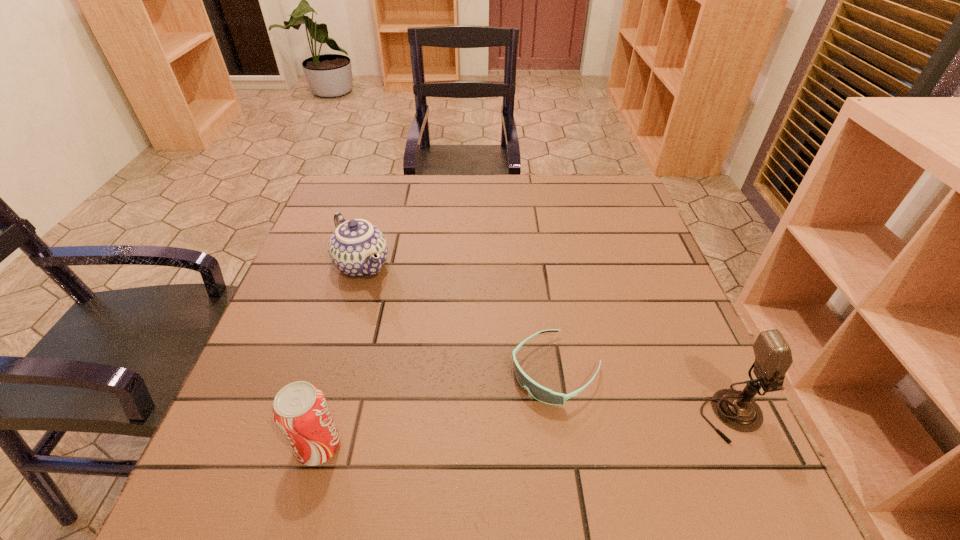
The width and height of the screenshot is (960, 540). Find the location of `free space between the soda can and the shortest object`. free space between the soda can and the shortest object is located at coordinates (438, 408).

In order to click on vacant area that lies between the farthest object and the tallest object in this screenshot , I will do `click(547, 340)`.

Identify the location of free space between the microphone and the soda can. This screenshot has width=960, height=540. (525, 431).

Identify the location of vacant space that's between the soda can and the rightmost object. (525, 431).

Locate an element on the screen. unoccupied position between the second object from right to left and the farthest object is located at coordinates (459, 318).

This screenshot has height=540, width=960. What are the coordinates of `free space between the shortest object and the soda can` in the screenshot? It's located at (438, 408).

Where is `vacant space that's between the chinaware and the second object from right to left`? The width and height of the screenshot is (960, 540). vacant space that's between the chinaware and the second object from right to left is located at coordinates pyautogui.click(x=459, y=318).

I want to click on the closest object relative to the tallest object, so click(538, 392).

The image size is (960, 540). I want to click on object identified as the third closest to the tallest object, so click(x=357, y=248).

You are a GUI agent. You are given a task and a screenshot of the screen. Output one action in this format:
    pyautogui.click(x=<x>, y=<y>)
    Task: Click on the free location that satisfies the following two spatial constraints: 1. on the front side of the chinaware; 2. on the left side of the goggles
    
    Given the screenshot: What is the action you would take?
    pyautogui.click(x=331, y=370)